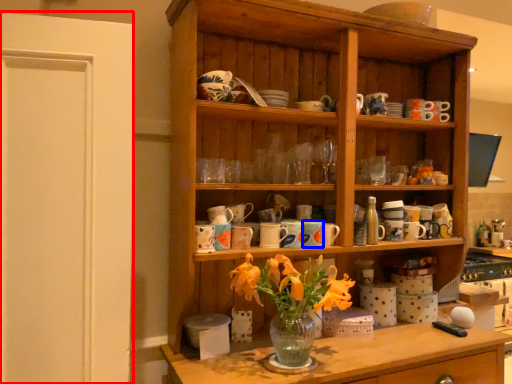
Question: Which point is closer to the camera, glass door (highlighted by a red box) or tableware (highlighted by a blue box)?

Choices:
 (A) glass door
 (B) tableware

Answer: (A)